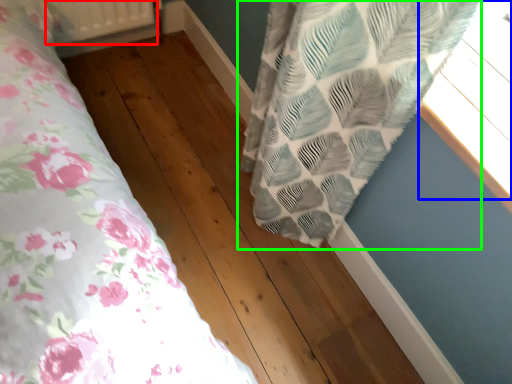
Question: Which object is positioned closest to radiator (highlighted by a red box)? Select from window (highlighted by a blue box) and curtain (highlighted by a green box).

Choices:
 (A) window
 (B) curtain

Answer: (B)